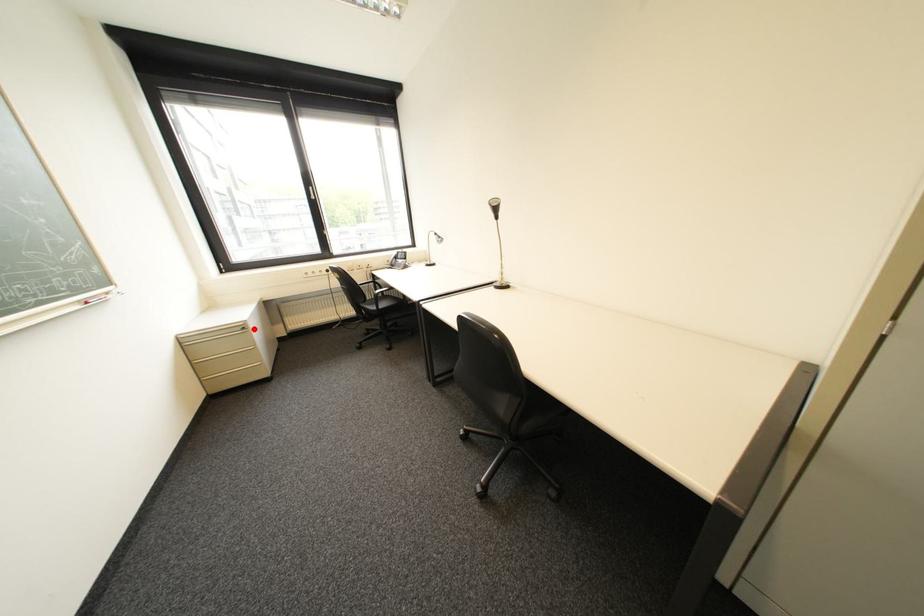
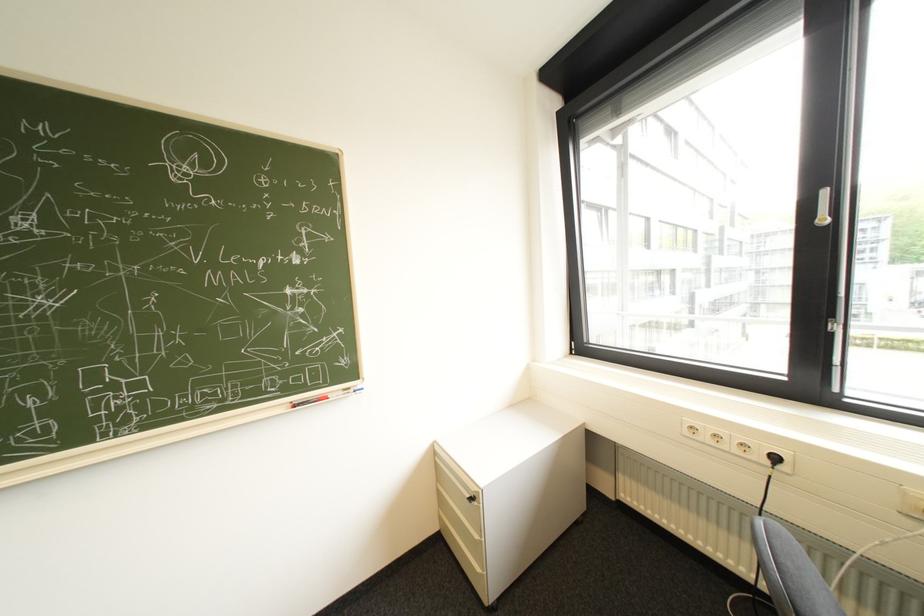
Find the pixel in the second image that matches the highlighted location in the first image.

(482, 499)